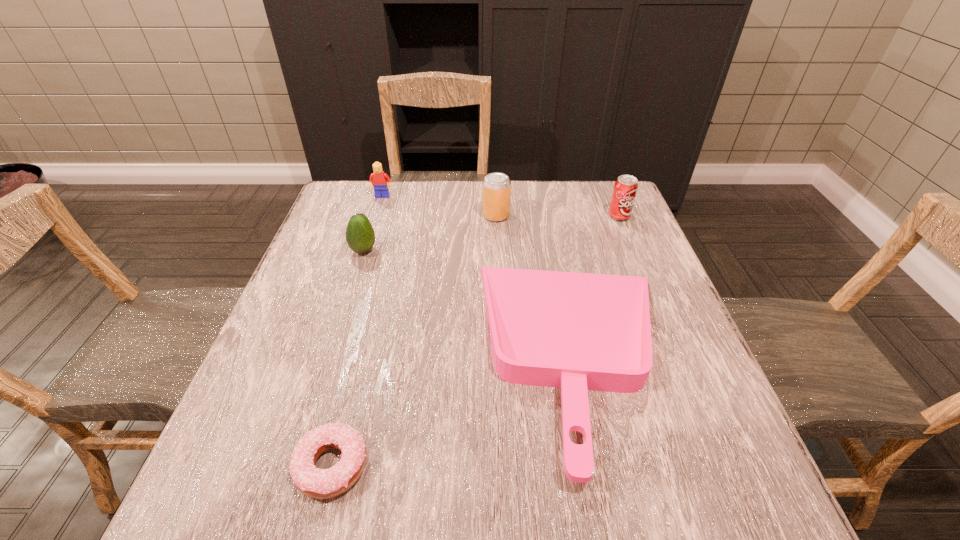
Where is `free space located 0.170m on the handle side of the dustpan`? free space located 0.170m on the handle side of the dustpan is located at coordinates (396, 355).

Locate an element on the screen. vacant space located 0.250m on the handle side of the dustpan is located at coordinates (357, 355).

This screenshot has height=540, width=960. In order to click on vacant space located on the handle side of the dustpan in this screenshot , I will do `click(407, 355)`.

You are a GUI agent. You are given a task and a screenshot of the screen. Output one action in this format:
    pyautogui.click(x=<x>, y=<y>)
    Task: Click on the free location located on the back of the shortest object
    The height and width of the screenshot is (540, 960).
    Given the screenshot: What is the action you would take?
    pyautogui.click(x=376, y=291)

Identify the location of Lego positioned at the far edge. (378, 179).

Locate an element on the screen. The image size is (960, 540). dustpan at the near edge is located at coordinates (576, 331).

Image resolution: width=960 pixels, height=540 pixels. I want to click on doughnut positioned at the near edge, so click(316, 483).

Locate an element on the screen. Image resolution: width=960 pixels, height=540 pixels. Lego positioned at the left edge is located at coordinates (378, 179).

Find the location of a particular element. Image resolution: width=960 pixels, height=540 pixels. avocado located in the left edge section of the desktop is located at coordinates (360, 236).

Locate an element on the screen. doughnut that is at the left edge is located at coordinates (316, 483).